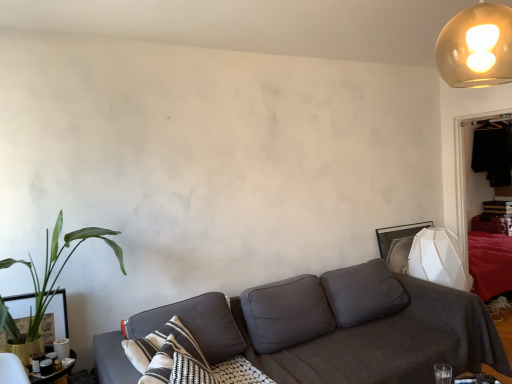
Question: Would you consider translucent glass globe at upper right to be distant from dark brown wooden dresser at right?

Choices:
 (A) no
 (B) yes

Answer: (B)

Question: Does translucent glass globe at upper right have a greater width compared to dark brown wooden dresser at right?

Choices:
 (A) yes
 (B) no

Answer: (A)

Question: Does translucent glass globe at upper right have a lesser height compared to dark brown wooden dresser at right?

Choices:
 (A) no
 (B) yes

Answer: (B)

Question: Does translucent glass globe at upper right have a greater height compared to dark brown wooden dresser at right?

Choices:
 (A) no
 (B) yes

Answer: (A)

Question: Can you confirm if translucent glass globe at upper right is bigger than dark brown wooden dresser at right?

Choices:
 (A) yes
 (B) no

Answer: (B)

Question: From a real-world perspective, is dark gray fabric couch at center physically located above or below translucent glass globe at upper right?

Choices:
 (A) above
 (B) below

Answer: (B)

Question: From the image's perspective, is dark gray fabric couch at center located above or below translucent glass globe at upper right?

Choices:
 (A) below
 (B) above

Answer: (A)

Question: Considering the positions of dark gray fabric couch at center and translucent glass globe at upper right in the image, is dark gray fabric couch at center taller or shorter than translucent glass globe at upper right?

Choices:
 (A) tall
 (B) short

Answer: (A)

Question: Looking at the image, does dark gray fabric couch at center seem bigger or smaller compared to translucent glass globe at upper right?

Choices:
 (A) small
 (B) big

Answer: (B)

Question: From the image's perspective, relative to translucent glass globe at upper right, is white matte geometric lampshade at right above or below?

Choices:
 (A) below
 (B) above

Answer: (A)

Question: Is white matte geometric lampshade at right in front of or behind translucent glass globe at upper right in the image?

Choices:
 (A) front
 (B) behind

Answer: (B)

Question: In terms of size, does white matte geometric lampshade at right appear bigger or smaller than translucent glass globe at upper right?

Choices:
 (A) big
 (B) small

Answer: (A)

Question: In the image, is white matte geometric lampshade at right on the left side or the right side of translucent glass globe at upper right?

Choices:
 (A) right
 (B) left

Answer: (A)

Question: In terms of height, does white matte geometric lampshade at right look taller or shorter compared to dark gray fabric pillow at center?

Choices:
 (A) tall
 (B) short

Answer: (A)

Question: From the image's perspective, relative to dark gray fabric pillow at center, is white matte geometric lampshade at right above or below?

Choices:
 (A) above
 (B) below

Answer: (A)